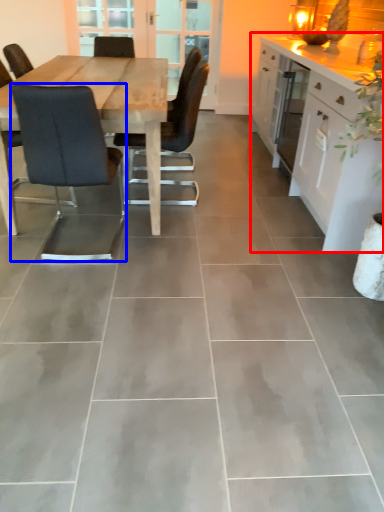
Question: Which point is further to the camera, cabinetry (highlighted by a red box) or chair (highlighted by a blue box)?

Choices:
 (A) cabinetry
 (B) chair

Answer: (A)